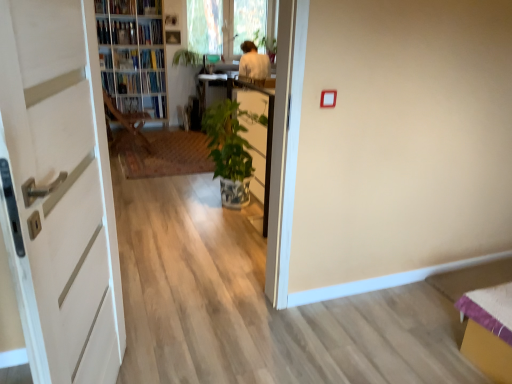
Question: Is the depth of wooden bookshelf at upper left greater than that of hardcover book at upper left, which ranks as the third book in right-to-left order?

Choices:
 (A) no
 (B) yes

Answer: (A)

Question: Would you say wooden bookshelf at upper left contains hardcover book at upper left, positioned as the 2th book in left-to-right order?

Choices:
 (A) no
 (B) yes

Answer: (B)

Question: Does wooden bookshelf at upper left have a lesser height compared to hardcover book at upper left, positioned as the 2th book in left-to-right order?

Choices:
 (A) yes
 (B) no

Answer: (B)

Question: From the image's perspective, is wooden bookshelf at upper left above hardcover book at upper left, which ranks as the third book in right-to-left order?

Choices:
 (A) no
 (B) yes

Answer: (A)

Question: Are wooden bookshelf at upper left and hardcover book at upper left, which ranks as the third book in right-to-left order, located far from each other?

Choices:
 (A) yes
 (B) no

Answer: (B)

Question: From their relative heights in the image, would you say wooden chair at center is taller or shorter than hardcover book at center, the fourth book from the left?

Choices:
 (A) short
 (B) tall

Answer: (B)

Question: From the image's perspective, is wooden chair at center above or below hardcover book at center, the fourth book from the left?

Choices:
 (A) below
 (B) above

Answer: (A)

Question: Considering the positions of point (115, 114) and point (161, 72), is point (115, 114) closer or farther from the camera than point (161, 72)?

Choices:
 (A) farther
 (B) closer

Answer: (B)

Question: Looking at the image, does wooden chair at center seem bigger or smaller compared to hardcover book at center, which ranks as the 1th book in right-to-left order?

Choices:
 (A) big
 (B) small

Answer: (A)

Question: Considering the positions of wooden bookshelf at upper left and hardcover book at center, the fourth book from the left, in the image, is wooden bookshelf at upper left bigger or smaller than hardcover book at center, the fourth book from the left,?

Choices:
 (A) big
 (B) small

Answer: (A)

Question: Visually, is wooden bookshelf at upper left positioned to the left or to the right of hardcover book at center, which ranks as the 1th book in right-to-left order?

Choices:
 (A) right
 (B) left

Answer: (B)

Question: From the image's perspective, is wooden bookshelf at upper left located above or below hardcover book at center, the fourth book from the left?

Choices:
 (A) below
 (B) above

Answer: (B)

Question: Relative to hardcover book at center, the fourth book from the left, is wooden bookshelf at upper left in front or behind?

Choices:
 (A) behind
 (B) front

Answer: (B)

Question: From a real-world perspective, is green glossy plant at upper center above or below hardcover book at center, which ranks as the 1th book in right-to-left order?

Choices:
 (A) below
 (B) above

Answer: (B)

Question: From the image's perspective, is green glossy plant at upper center located above or below hardcover book at center, which ranks as the 1th book in right-to-left order?

Choices:
 (A) below
 (B) above

Answer: (B)